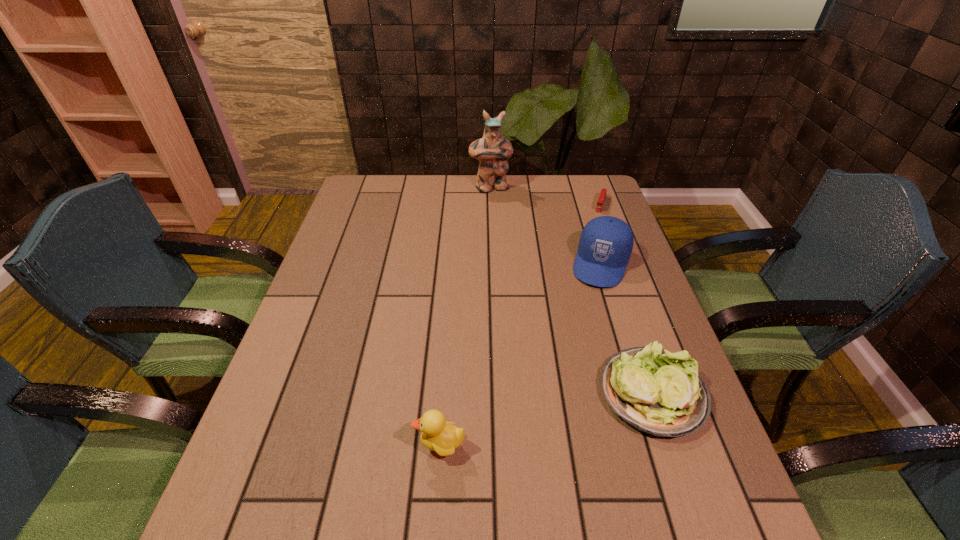
Where is `vacant space on the desktop that is between the duckling and the lettuce and is positioned on the front-facing side of the farthest object`? vacant space on the desktop that is between the duckling and the lettuce and is positioned on the front-facing side of the farthest object is located at coordinates (583, 411).

You are a GUI agent. You are given a task and a screenshot of the screen. Output one action in this format:
    pyautogui.click(x=<x>, y=<y>)
    Task: Click on the vacant space on the desktop that is between the duckling and the fourth tallest object and is positioned on the front-facing side of the cap
    This screenshot has height=540, width=960.
    Given the screenshot: What is the action you would take?
    pyautogui.click(x=550, y=419)

Where is `vacant spot on the desktop that is between the duckling and the lettuce and is positioned on the front-facing side of the fourth nearest object`? vacant spot on the desktop that is between the duckling and the lettuce and is positioned on the front-facing side of the fourth nearest object is located at coordinates (529, 424).